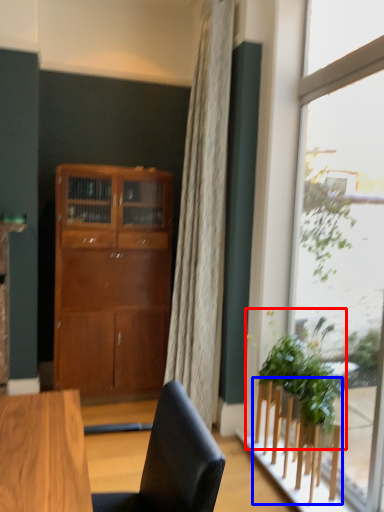
Question: Among these objects, which one is farthest to the camera, houseplant (highlighted by a red box) or furniture (highlighted by a blue box)?

Choices:
 (A) houseplant
 (B) furniture

Answer: (A)